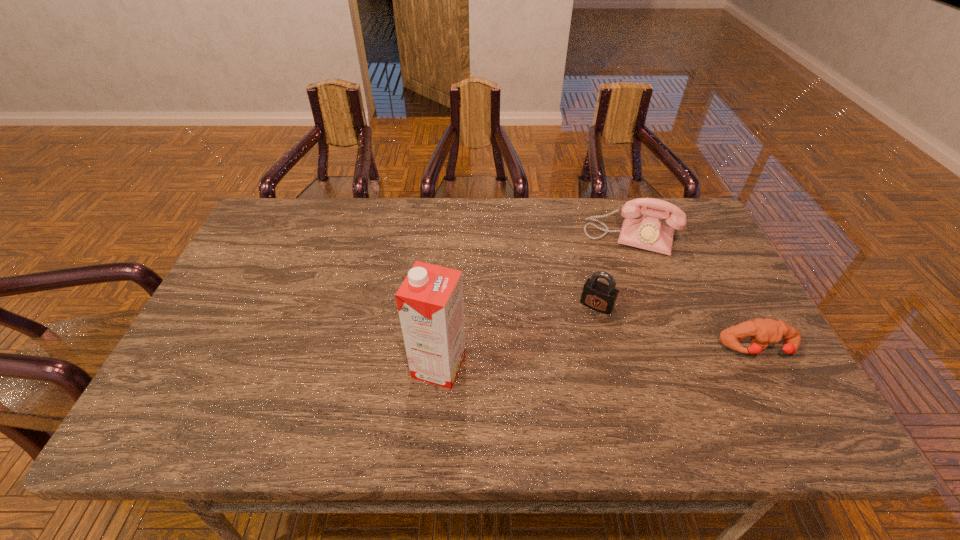
Identify the location of carton. This screenshot has height=540, width=960. coord(430,300).

Where is `the tallest object`? the tallest object is located at coordinates (430, 300).

Locate an element on the screen. This screenshot has height=540, width=960. the shortest object is located at coordinates (762, 332).

I want to click on telephone, so click(x=648, y=232).

The height and width of the screenshot is (540, 960). I want to click on the farthest object, so click(648, 232).

Identify the location of padlock. (596, 295).

Find the location of `the second farthest object`. the second farthest object is located at coordinates (596, 295).

Locate an element on the screen. The width and height of the screenshot is (960, 540). vacant space located on the left of the tallest object is located at coordinates (264, 366).

The height and width of the screenshot is (540, 960). Identify the location of free region located 0.070m on the dial of the farthest object. (616, 272).

Where is `vacant space located 0.090m on the dial of the farthest object`? Image resolution: width=960 pixels, height=540 pixels. vacant space located 0.090m on the dial of the farthest object is located at coordinates (614, 276).